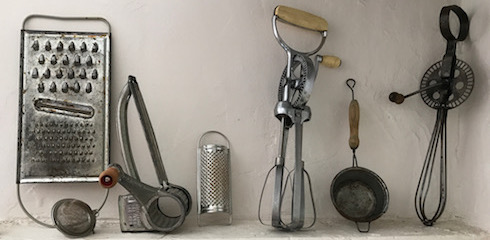
Where is `shelf bottom`? shelf bottom is located at coordinates (44, 235), (108, 234), (207, 231), (326, 229), (388, 230), (458, 226).